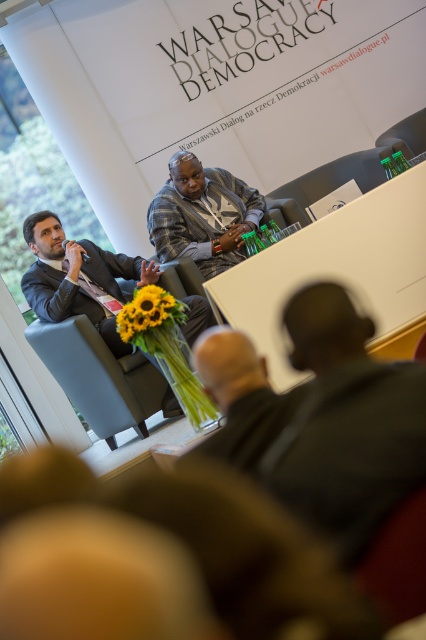
Can you confirm if dark gray shirt at center is taller than dark gray suit at center?

No.

Can you confirm if dark gray shirt at center is positioned below dark gray suit at center?

Yes.

Locate an element on the screen. This screenshot has width=426, height=640. dark gray shirt at center is located at coordinates (322, 419).

Is matte black suit at left smaller than dark gray suit at center?

No, matte black suit at left is not smaller than dark gray suit at center.

Is matte black suit at left to the left of dark gray suit at center from the viewer's perspective?

Correct, you'll find matte black suit at left to the left of dark gray suit at center.

The height and width of the screenshot is (640, 426). What are the coordinates of `matte black suit at left` in the screenshot? It's located at (77, 276).

Can you confirm if matte black suit at left is positioned above blue fabric chair at center?

Yes, matte black suit at left is above blue fabric chair at center.

Is matte black suit at left taller than blue fabric chair at center?

Indeed, matte black suit at left has a greater height compared to blue fabric chair at center.

Which is behind, point (166, 390) or point (146, 435)?

The point (166, 390) is behind.

Find the location of a particular element. This screenshot has width=426, height=640. matte black suit at left is located at coordinates (77, 276).